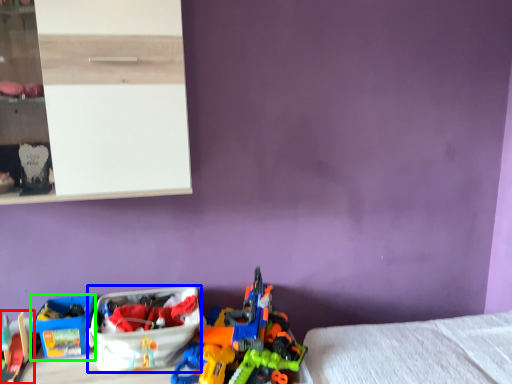
Question: Based on their relative distances, which object is nearer to toy (highlighted by a red box)? Choose from storage box (highlighted by a blue box) and storage box (highlighted by a green box).

Choices:
 (A) storage box
 (B) storage box

Answer: (B)